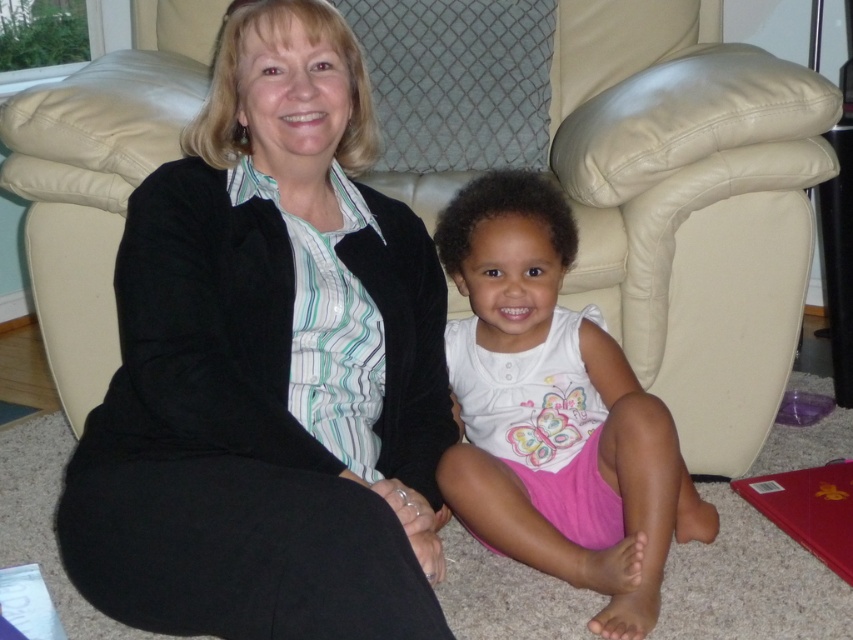
From the picture: You are trying to decide whether to place a new decorative pillow on the velvet black jacket at center or the beige leather armchair at center. Based on their heights, which surface is more suitable for placing the pillow?

The beige leather armchair at center is taller than the velvet black jacket at center, so placing the decorative pillow on the beige leather armchair at center would be more suitable as it provides a stable and elevated surface.

You are standing in the living room and want to sit on the beige leather armchair at center. There is a point at coordinates (x=689, y=205). Is this point on the beige leather armchair at center?

Yes, the point at coordinates (x=689, y=205) is on the beige leather armchair at center.

You are standing in the living room and want to place a small potted plant between the beige leather armchair at center and the white cotton shirt at center. Which object should the plant be closer to based on their positions?

The beige leather armchair at center is further to the viewer than the white cotton shirt at center, so the plant should be placed closer to the white cotton shirt at center to maintain equal distance between both objects.